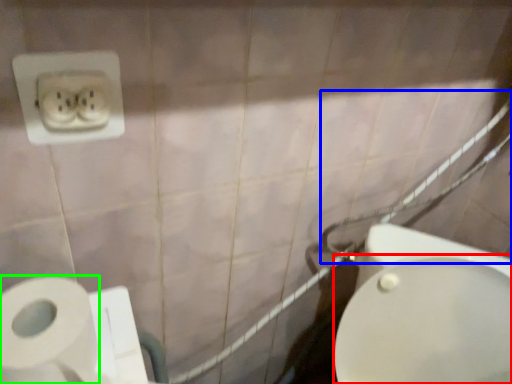
Question: Based on their relative distances, which object is farther from bidet (highlighted by a red box)? Choose from shower (highlighted by a blue box) and toilet paper (highlighted by a green box).

Choices:
 (A) shower
 (B) toilet paper

Answer: (B)